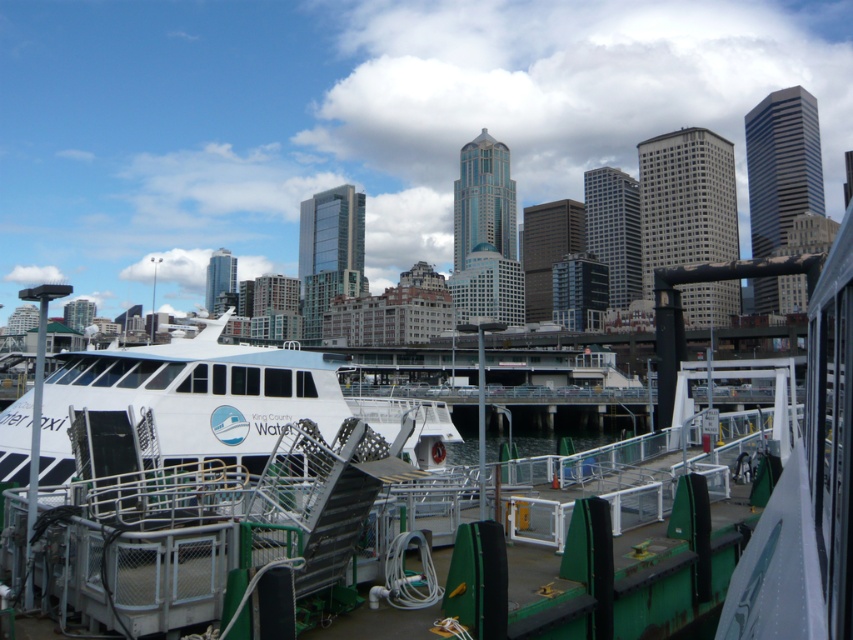
Question: Among these objects, which one is farthest from the camera?

Choices:
 (A) white glossy ferry at center
 (B) clear water at dock center

Answer: (B)

Question: Can you confirm if white glossy ferry at center is positioned to the left of clear water at dock center?

Choices:
 (A) yes
 (B) no

Answer: (A)

Question: Is white glossy ferry at center thinner than clear water at dock center?

Choices:
 (A) yes
 (B) no

Answer: (A)

Question: Can you confirm if white glossy ferry at center is bigger than clear water at dock center?

Choices:
 (A) no
 (B) yes

Answer: (A)

Question: Which point is closer to the camera taking this photo?

Choices:
 (A) (463, 461)
 (B) (430, 464)

Answer: (B)

Question: Among these objects, which one is farthest from the camera?

Choices:
 (A) clear water at dock center
 (B) white glossy ferry at center

Answer: (A)